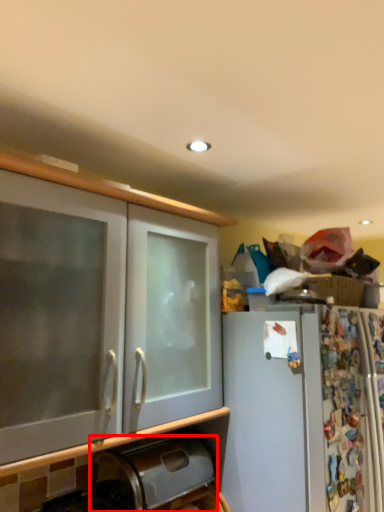
Question: Observing the image, what is the correct spatial positioning of appliance (annotated by the red box) in reference to cabinetry?

Choices:
 (A) left
 (B) right

Answer: (B)